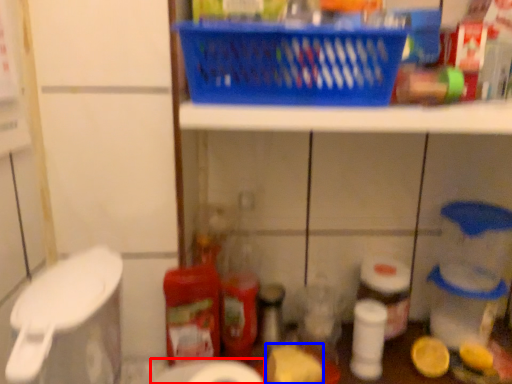
Question: Which point is closer to the camera, toilet paper (highlighted by a red box) or food (highlighted by a blue box)?

Choices:
 (A) toilet paper
 (B) food

Answer: (A)